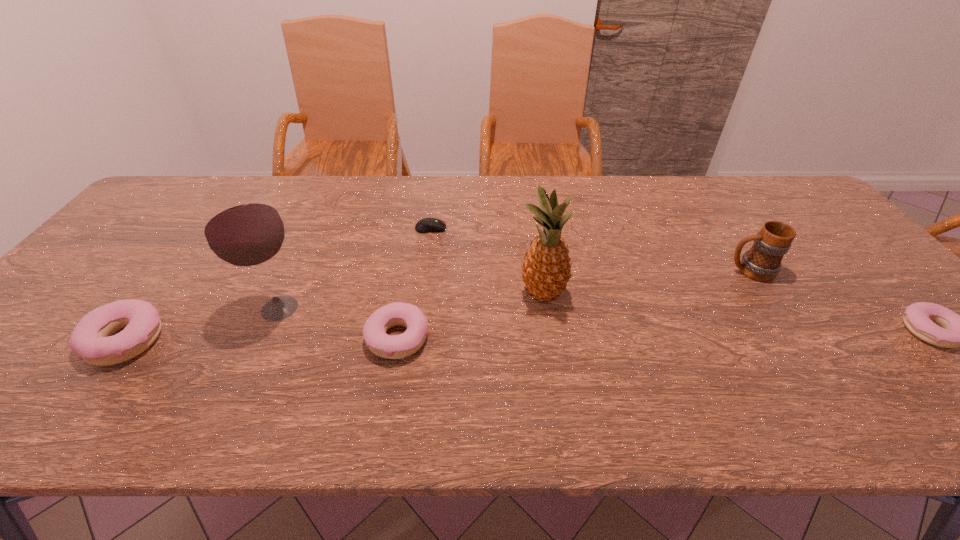
You are a GUI agent. You are given a task and a screenshot of the screen. Output one action in this format:
    pyautogui.click(x=<x>, y=<y>)
    Task: Click on the free space at the near edge of the desktop
    The height and width of the screenshot is (540, 960).
    Given the screenshot: What is the action you would take?
    pyautogui.click(x=806, y=370)

Identify the location of vacant region at the far right corner of the desktop. The image size is (960, 540). (805, 214).

The height and width of the screenshot is (540, 960). I want to click on free space between the second object from right to left and the leftmost object, so click(438, 306).

Locate an element on the screen. unoccupied area between the second doughnut from left to right and the leftmost doughnut is located at coordinates (262, 339).

The height and width of the screenshot is (540, 960). Identify the location of vacant point located between the sixth object from left to right and the alcohol. (515, 289).

Where is `vacant area that lies between the leftmost doughnut and the second shortest doughnut`? vacant area that lies between the leftmost doughnut and the second shortest doughnut is located at coordinates (262, 339).

Identify the location of blank region between the leftmost object and the third tallest object. This screenshot has width=960, height=540. (438, 306).

I want to click on object identified as the third closest to the leftmost doughnut, so click(426, 225).

You are a GUI agent. You are given a task and a screenshot of the screen. Output one action in this format:
    pyautogui.click(x=<x>, y=<y>)
    Task: Click on the object that is the third nearest to the mug
    The height and width of the screenshot is (540, 960).
    Given the screenshot: What is the action you would take?
    pyautogui.click(x=426, y=225)

Image resolution: width=960 pixels, height=540 pixels. In order to click on the third closest doughnut to the alcohol in this screenshot , I will do `click(935, 324)`.